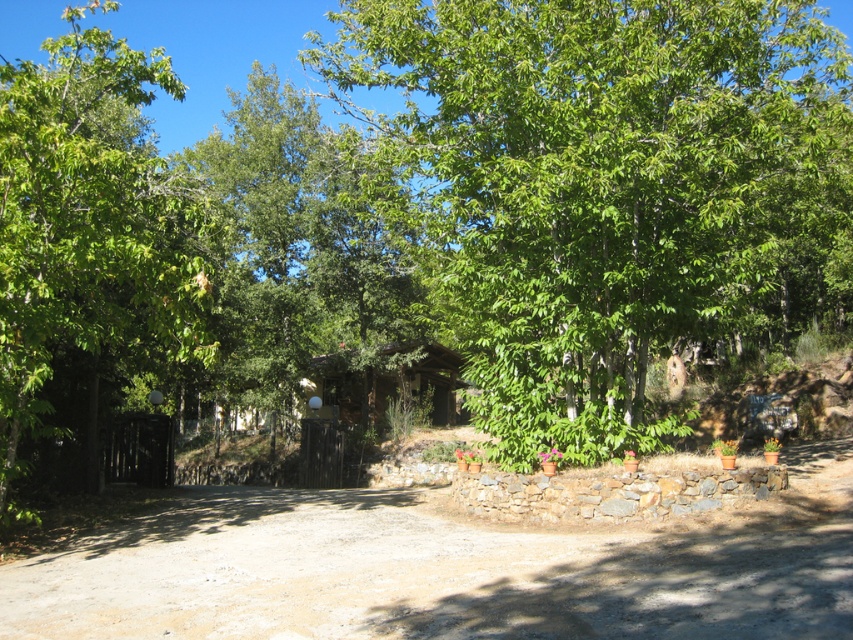
Based on the photo, can you confirm if green leafy tree at center is positioned above green leafy tree at left?

Actually, green leafy tree at center is below green leafy tree at left.

Measure the distance between green leafy tree at center and camera.

green leafy tree at center is 9.19 meters away from camera.

You are a GUI agent. You are given a task and a screenshot of the screen. Output one action in this format:
    pyautogui.click(x=<x>, y=<y>)
    Task: Click on the green leafy tree at center
    The image size is (853, 640).
    Given the screenshot: What is the action you would take?
    pyautogui.click(x=605, y=188)

Does brown gravel dirt track at lower center appear over green leafy tree at left?

Actually, brown gravel dirt track at lower center is below green leafy tree at left.

Can you confirm if brown gravel dirt track at lower center is taller than green leafy tree at left?

In fact, brown gravel dirt track at lower center may be shorter than green leafy tree at left.

Which is behind, point (714, 593) or point (39, 166)?

Positioned behind is point (39, 166).

The image size is (853, 640). I want to click on brown gravel dirt track at lower center, so click(x=447, y=568).

Is green leafy tree at center taller than brown gravel dirt track at lower center?

Correct, green leafy tree at center is much taller as brown gravel dirt track at lower center.

Is green leafy tree at center to the right of brown gravel dirt track at lower center from the viewer's perspective?

Yes, green leafy tree at center is to the right of brown gravel dirt track at lower center.

Between point (802, 193) and point (564, 589), which one is positioned behind?

Positioned behind is point (802, 193).

Locate an element on the screen. The height and width of the screenshot is (640, 853). green leafy tree at center is located at coordinates (605, 188).